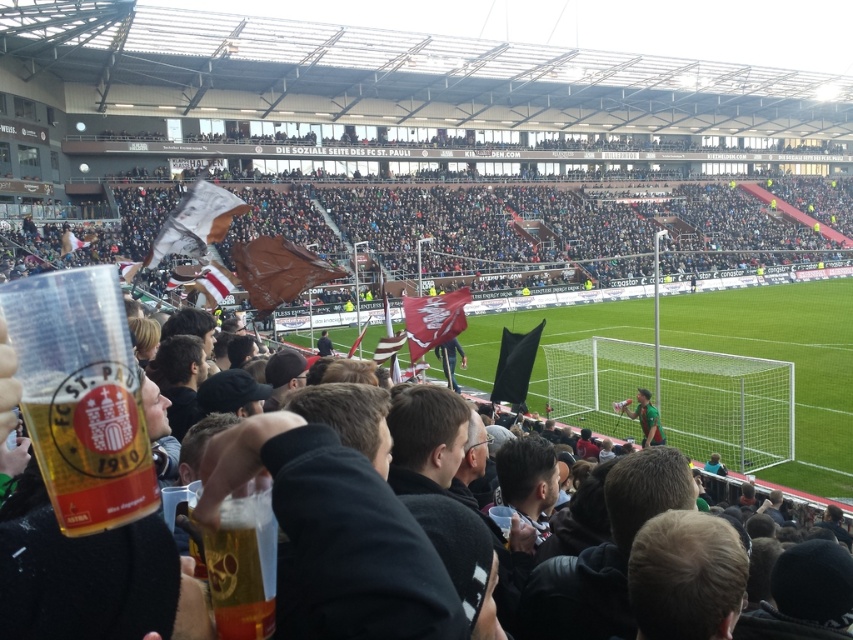
Question: Which object is the farthest from the translucent plastic cup at center?

Choices:
 (A) green grass football field at center
 (B) green jersey at center
 (C) dark brown fabric at upper center
 (D) translucent plastic cup at lower left

Answer: (C)

Question: Does dark brown fabric at upper center have a smaller size compared to translucent plastic cup at lower left?

Choices:
 (A) yes
 (B) no

Answer: (B)

Question: Among these points, which one is farthest from the camera?

Choices:
 (A) (647, 401)
 (B) (405, 198)

Answer: (B)

Question: Is green grass football field at center below translucent plastic cup at lower left?

Choices:
 (A) no
 (B) yes

Answer: (A)

Question: Is green grass football field at center bigger than translucent plastic cup at center?

Choices:
 (A) yes
 (B) no

Answer: (A)

Question: Which of these objects is positioned closest to the translucent plastic cup at lower left?

Choices:
 (A) green grass football field at center
 (B) translucent plastic cup at center

Answer: (B)